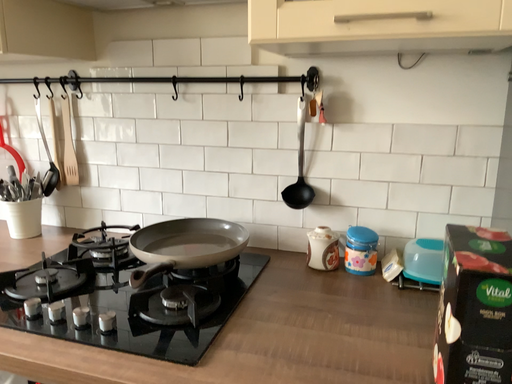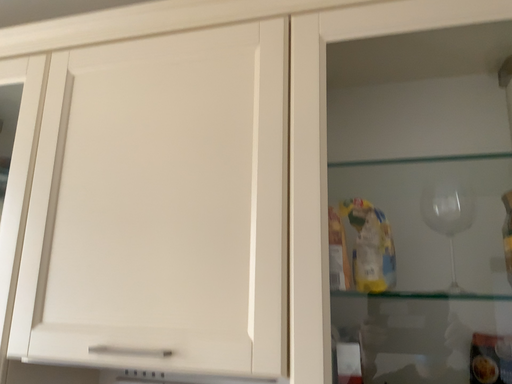
Question: Which way did the camera rotate in the video?

Choices:
 (A) rotated downward
 (B) rotated upward

Answer: (B)